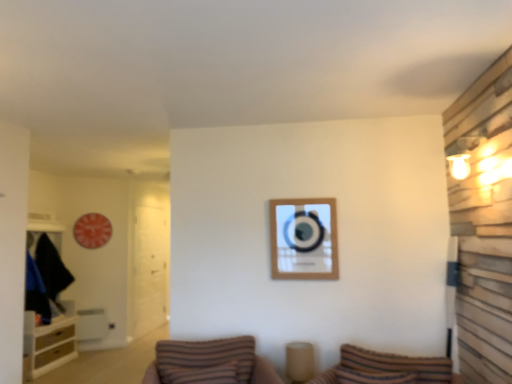
At what (x,y) coordinates should I click in order to perform the action: click on striped fabric pillow at lower center. Please return your answer as a coordinate pair (x, y). Image resolution: width=512 pixels, height=384 pixels. Looking at the image, I should click on (372, 376).

The height and width of the screenshot is (384, 512). Find the location of `wooden cabinet at left`. wooden cabinet at left is located at coordinates (46, 307).

The image size is (512, 384). I want to click on glass door lying behind the striped fabric pillow at lower center, so click(x=150, y=268).

Between transparent glass door at left and striped fabric pillow at lower center, which one appears on the right side from the viewer's perspective?

striped fabric pillow at lower center.

Looking at their sizes, would you say transparent glass door at left is wider or thinner than striped fabric pillow at lower center?

transparent glass door at left is thinner than striped fabric pillow at lower center.

Is striped fabric pillow at lower center inside transparent glass door at left?

No, striped fabric pillow at lower center is not inside transparent glass door at left.

Is wooden cabinet at left aimed at wooden picture frame at center?

No, wooden cabinet at left is not oriented towards wooden picture frame at center.

From a real-world perspective, is wooden cabinet at left positioned under wooden picture frame at center based on gravity?

Yes, from a real-world perspective, wooden cabinet at left is beneath wooden picture frame at center.

Based on the photo, which is correct: wooden cabinet at left is inside wooden picture frame at center, or outside of it?

The correct answer is: outside.

Considering the sizes of objects wooden cabinet at left and wooden picture frame at center in the image provided, who is wider, wooden cabinet at left or wooden picture frame at center?

wooden cabinet at left.

Considering the sizes of objects striped fabric pillow at lower center and wooden cabinet at left in the image provided, who is thinner, striped fabric pillow at lower center or wooden cabinet at left?

striped fabric pillow at lower center is thinner.

From the image's perspective, does striped fabric pillow at lower center appear lower than wooden cabinet at left?

No.

In the scene shown: Can you tell me how much striped fabric pillow at lower center and wooden cabinet at left differ in facing direction?

striped fabric pillow at lower center and wooden cabinet at left are facing 103 degrees away from each other.

Which is more to the left, striped fabric pillow at lower center or wooden cabinet at left?

wooden cabinet at left is more to the left.

Which object is further away from the camera taking this photo, wooden picture frame at center or transparent glass door at left?

transparent glass door at left is further away from the camera.

From the image's perspective, is wooden picture frame at center below transparent glass door at left?

Incorrect, from the image's perspective, wooden picture frame at center is higher than transparent glass door at left.

From a real-world perspective, between wooden picture frame at center and transparent glass door at left, who is vertically higher?

In real-world perspective, wooden picture frame at center is above.

Does point (318, 221) lie behind point (162, 210)?

That is False.

How much distance is there between wooden picture frame at center and striped fabric pillow at lower center?

wooden picture frame at center and striped fabric pillow at lower center are 36.01 inches apart.

Consider the image. From the image's perspective, is wooden picture frame at center located above or below striped fabric pillow at lower center?

Clearly, from the image's perspective, wooden picture frame at center is above striped fabric pillow at lower center.

Would you consider wooden picture frame at center to be distant from striped fabric pillow at lower center?

Actually, wooden picture frame at center and striped fabric pillow at lower center are a little close together.

From a real-world perspective, which object stands above the other?

wooden picture frame at center.

Consider the image. Is transparent glass door at left completely or partially outside of wooden picture frame at center?

transparent glass door at left lies outside wooden picture frame at center's area.

Based on the photo, from a real-world perspective, which object rests below the other?

transparent glass door at left.

Which point is more distant from viewer, (143, 281) or (317, 277)?

Point (143, 281)

The width and height of the screenshot is (512, 384). Find the location of `glass door to the left of wooden picture frame at center`. glass door to the left of wooden picture frame at center is located at coordinates [x=150, y=268].

Does striped fabric pillow at lower center touch transparent glass door at left?

No, striped fabric pillow at lower center is not touching transparent glass door at left.

Which object is more forward, striped fabric pillow at lower center or transparent glass door at left?

striped fabric pillow at lower center is closer to the camera.

Could transparent glass door at left be considered to be inside striped fabric pillow at lower center?

Actually, transparent glass door at left is outside striped fabric pillow at lower center.

At what (x,y) coordinates should I click in order to perform the action: click on pillow below the transparent glass door at left (from a real-world perspective). Please return your answer as a coordinate pair (x, y). This screenshot has height=384, width=512. Looking at the image, I should click on (372, 376).

In the image, there is a wooden cabinet at left. At what (x,y) coordinates should I click in order to perform the action: click on picture frame above it (from the image's perspective). Please return your answer as a coordinate pair (x, y). The image size is (512, 384). Looking at the image, I should click on (303, 239).

Considering their positions, is wooden cabinet at left positioned further to striped fabric pillow at lower center than wooden picture frame at center?

wooden cabinet at left is positioned further to the anchor striped fabric pillow at lower center.

When comparing their distances from wooden picture frame at center, does brown striped pillow at center or transparent glass door at left seem closer?

brown striped pillow at center.

Based on the photo, which object lies further to the anchor point wooden picture frame at center, transparent glass door at left or wooden cabinet at left?

wooden cabinet at left is positioned further to the anchor wooden picture frame at center.

From the image, which object appears to be farther from wooden picture frame at center, brown striped pillow at center or wooden cabinet at left?

wooden cabinet at left is further to wooden picture frame at center.

Estimate the real-world distances between objects in this image. Which object is further from transparent glass door at left, wooden picture frame at center or wooden cabinet at left?

wooden picture frame at center is further to transparent glass door at left.

Estimate the real-world distances between objects in this image. Which object is further from wooden cabinet at left, wooden picture frame at center or transparent glass door at left?

wooden picture frame at center is positioned further to the anchor wooden cabinet at left.

From the image, which object appears to be farther from transparent glass door at left, wooden cabinet at left or striped fabric pillow at lower center?

Among the two, striped fabric pillow at lower center is located further to transparent glass door at left.

Considering their positions, is brown striped pillow at center positioned closer to wooden cabinet at left than wooden picture frame at center?

brown striped pillow at center is positioned closer to the anchor wooden cabinet at left.

Image resolution: width=512 pixels, height=384 pixels. Find the location of `picture frame positioned between brown striped pillow at center and transparent glass door at left from near to far`. picture frame positioned between brown striped pillow at center and transparent glass door at left from near to far is located at coordinates (303, 239).

Identify the location of furniture between wooden cabinet at left and wooden picture frame at center in the horizontal direction. (210, 362).

This screenshot has height=384, width=512. What are the coordinates of `furniture between wooden cabinet at left and striped fabric pillow at lower center in the horizontal direction` in the screenshot? It's located at (210, 362).

You are a GUI agent. You are given a task and a screenshot of the screen. Output one action in this format:
    pyautogui.click(x=<x>, y=<y>)
    Task: Click on the picture frame between striped fabric pillow at lower center and transparent glass door at left along the z-axis
    This screenshot has height=384, width=512.
    Given the screenshot: What is the action you would take?
    pyautogui.click(x=303, y=239)